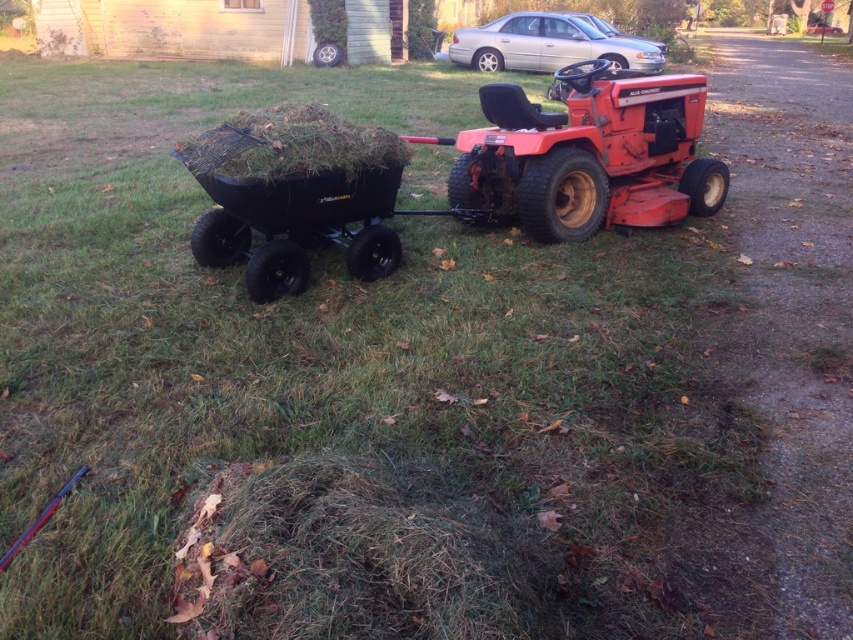
You are standing at the edge of the driveway and see the matte red tractor at center and the black rubber cart at center. Which object is positioned to the right side?

The matte red tractor at center is positioned to the right of the black rubber cart at center.

From the picture: You are a gardener planning to store the matte red tractor at center and the black rubber cart at center in a storage shed. The shed has a narrow doorway that only allows items up to 4 feet wide to pass through. Which item might you need to disassemble before moving it into the shed?

The matte red tractor at center might need to be disassembled because its width surpasses that of the black rubber cart at center, making it potentially wider than the 4 feet doorway limit.